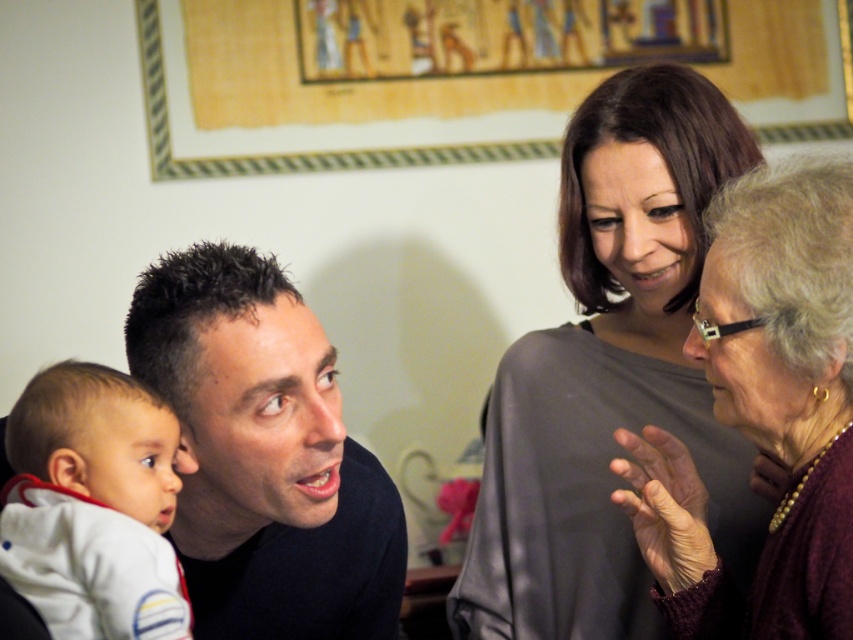
Does smooth gray blouse at upper right appear on the left side of white soft fabric baby at lower left?

No, smooth gray blouse at upper right is not to the left of white soft fabric baby at lower left.

Does smooth gray blouse at upper right have a greater height compared to white soft fabric baby at lower left?

Yes.

This screenshot has width=853, height=640. Identify the location of smooth gray blouse at upper right. [x=608, y=374].

Find the location of a particular element. smooth gray blouse at upper right is located at coordinates (608, 374).

Does smooth gray blouse at upper right have a greater width compared to dark blue shirt at left?

In fact, smooth gray blouse at upper right might be narrower than dark blue shirt at left.

Can you confirm if smooth gray blouse at upper right is positioned below dark blue shirt at left?

No.

Which is behind, point (641, 218) or point (331, 618)?

Point (641, 218)

Where is `smooth gray blouse at upper right`? smooth gray blouse at upper right is located at coordinates (608, 374).

Which is above, dark blue shirt at left or maroon textured sweater at upper right?

maroon textured sweater at upper right

Who is shorter, dark blue shirt at left or maroon textured sweater at upper right?

dark blue shirt at left

Is point (252, 266) positioned before point (795, 516)?

No.

Where is `dark blue shirt at left`? This screenshot has height=640, width=853. dark blue shirt at left is located at coordinates (265, 456).